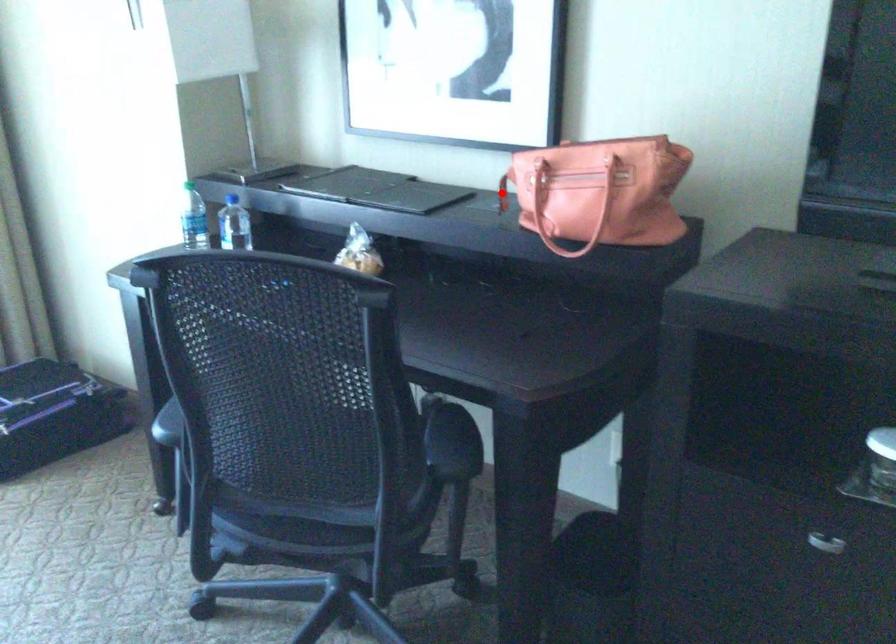
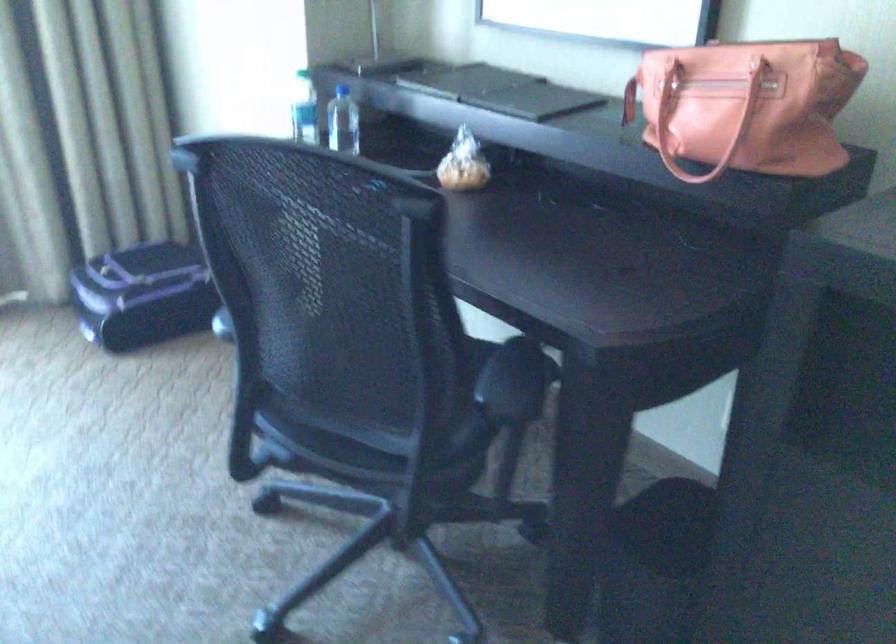
Question: I am providing you with two images of the same scene from different viewpoints. In image1, a red point is highlighted. Considering the same 3D point in image2, which of the following is correct?

Choices:
 (A) It is closer
 (B) It is farther

Answer: (A)